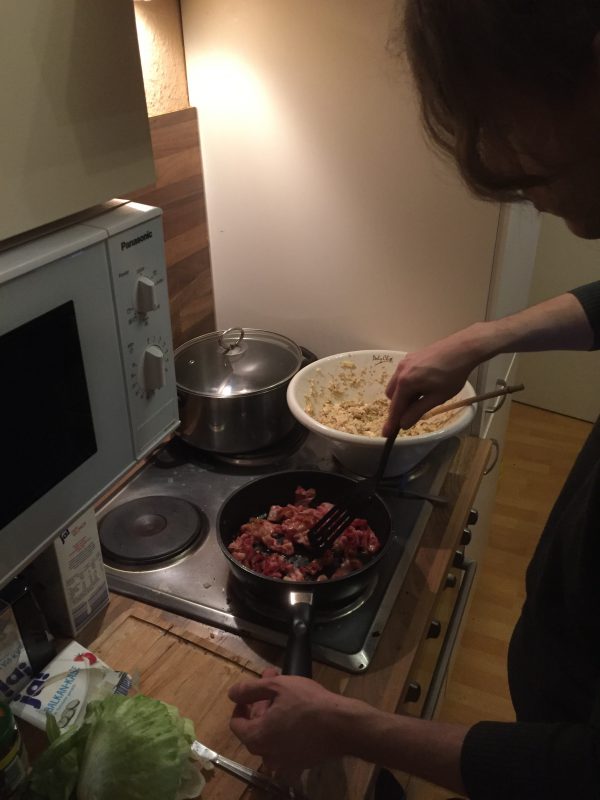
Find the location of a particular element. black fry pan is located at coordinates (335, 588).